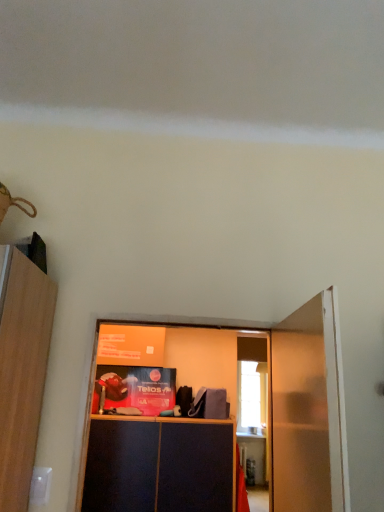
Locate an element on the screen. This screenshot has width=384, height=512. white glossy door at right is located at coordinates (309, 410).

What do you see at coordinates (309, 410) in the screenshot? I see `white glossy door at right` at bounding box center [309, 410].

Locate an element on the screen. This screenshot has height=512, width=384. dark wood cabinet at center is located at coordinates (158, 467).

Describe the element at coordinates (158, 467) in the screenshot. I see `dark wood cabinet at center` at that location.

Locate an element on the screen. The image size is (384, 512). white glossy door at right is located at coordinates (309, 410).

Does dark wood cabinet at center appear on the left side of white glossy door at right?

Yes, dark wood cabinet at center is to the left of white glossy door at right.

Does dark wood cabinet at center lie behind white glossy door at right?

Yes, dark wood cabinet at center is further from the camera.

Is point (207, 487) closer or farther from the camera than point (309, 436)?

Point (207, 487) appears to be farther away from the viewer than point (309, 436).

In the scene shown: From the image's perspective, would you say dark wood cabinet at center is shown under white glossy door at right?

Yes, from the image's perspective, dark wood cabinet at center is below white glossy door at right.

From a real-world perspective, is dark wood cabinet at center above or below white glossy door at right?

dark wood cabinet at center is below white glossy door at right.

Looking at this image, which object is thinner, dark wood cabinet at center or white glossy door at right?

With smaller width is white glossy door at right.

Considering the relative sizes of dark wood cabinet at center and white glossy door at right in the image provided, is dark wood cabinet at center taller than white glossy door at right?

No, dark wood cabinet at center is not taller than white glossy door at right.

Is dark wood cabinet at center bigger than white glossy door at right?

Correct, dark wood cabinet at center is larger in size than white glossy door at right.

Based on the photo, would you say dark wood cabinet at center contains white glossy door at right?

No, dark wood cabinet at center does not contain white glossy door at right.

Is dark wood cabinet at center positioned far away from white glossy door at right?

dark wood cabinet at center is far away from white glossy door at right.

Is white glossy door at right at the back of dark wood cabinet at center?

No, dark wood cabinet at center is not facing away from white glossy door at right.

Find the location of a particular element. Image resolution: width=384 pixels, height=512 pixels. door in front of the dark wood cabinet at center is located at coordinates (309, 410).

Is white glossy door at right at the right side of dark wood cabinet at center?

Indeed, white glossy door at right is positioned on the right side of dark wood cabinet at center.

Is the position of white glossy door at right more distant than that of dark wood cabinet at center?

No, white glossy door at right is closer to the camera.

Does point (342, 463) come closer to viewer compared to point (107, 419)?

Yes, it is in front of point (107, 419).

From the image's perspective, is white glossy door at right on top of dark wood cabinet at center?

Yes, from the image's perspective, white glossy door at right is above dark wood cabinet at center.

From a real-world perspective, which object stands above the other?

white glossy door at right, from a real-world perspective.

Can you confirm if white glossy door at right is wider than dark wood cabinet at center?

In fact, white glossy door at right might be narrower than dark wood cabinet at center.

Considering the sizes of objects white glossy door at right and dark wood cabinet at center in the image provided, who is taller, white glossy door at right or dark wood cabinet at center?

Answer: With more height is white glossy door at right.

Does white glossy door at right have a smaller size compared to dark wood cabinet at center?

Indeed, white glossy door at right has a smaller size compared to dark wood cabinet at center.

Is white glossy door at right inside the boundaries of dark wood cabinet at center, or outside?

white glossy door at right is located beyond the bounds of dark wood cabinet at center.

Can you see white glossy door at right touching dark wood cabinet at center?

No, white glossy door at right is not next to dark wood cabinet at center.

Is white glossy door at right facing towards dark wood cabinet at center?

No.

In order to click on door above the dark wood cabinet at center (from a real-world perspective) in this screenshot , I will do `click(309, 410)`.

Where is `cabinetry below the white glossy door at right (from the image's perspective)`? The width and height of the screenshot is (384, 512). cabinetry below the white glossy door at right (from the image's perspective) is located at coordinates [158, 467].

At what (x,y) coordinates should I click in order to perform the action: click on cabinetry on the left side of white glossy door at right. Please return your answer as a coordinate pair (x, y). Image resolution: width=384 pixels, height=512 pixels. Looking at the image, I should click on (158, 467).